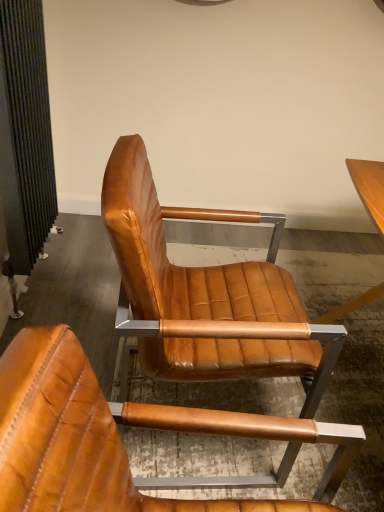
Question: Should I look upward or downward to see cognac leather chair at center, the second chair viewed from the front?

Choices:
 (A) down
 (B) up

Answer: (A)

Question: Is cognac leather chair at center, which is the 1th chair in back-to-front order, at the right side of cognac leather chair at center, marked as the first chair in a front-to-back arrangement?

Choices:
 (A) yes
 (B) no

Answer: (A)

Question: Is cognac leather chair at center, the second chair viewed from the front, in contact with cognac leather chair at center, marked as the first chair in a front-to-back arrangement?

Choices:
 (A) no
 (B) yes

Answer: (A)

Question: From a real-world perspective, is cognac leather chair at center, which is the 1th chair in back-to-front order, over cognac leather chair at center, marked as the first chair in a front-to-back arrangement?

Choices:
 (A) yes
 (B) no

Answer: (B)

Question: Is cognac leather chair at center, the second chair viewed from the front, positioned behind cognac leather chair at center, marked as the first chair in a front-to-back arrangement?

Choices:
 (A) yes
 (B) no

Answer: (A)

Question: Considering the relative sizes of cognac leather chair at center, the second chair viewed from the front, and cognac leather chair at center, marked as the first chair in a front-to-back arrangement, in the image provided, is cognac leather chair at center, the second chair viewed from the front, thinner than cognac leather chair at center, marked as the first chair in a front-to-back arrangement,?

Choices:
 (A) yes
 (B) no

Answer: (B)

Question: Is cognac leather chair at center, the second chair viewed from the front, to the left of cognac leather chair at center, marked as the first chair in a front-to-back arrangement, from the viewer's perspective?

Choices:
 (A) no
 (B) yes

Answer: (A)

Question: Is cognac leather chair at center, marked as the first chair in a front-to-back arrangement, taller than cognac leather chair at center, which is the 1th chair in back-to-front order?

Choices:
 (A) no
 (B) yes

Answer: (A)

Question: Is cognac leather chair at center, placed as the 2th chair when sorted from back to front, positioned far away from cognac leather chair at center, which is the 1th chair in back-to-front order?

Choices:
 (A) no
 (B) yes

Answer: (A)

Question: Is cognac leather chair at center, marked as the first chair in a front-to-back arrangement, to the left of cognac leather chair at center, the second chair viewed from the front, from the viewer's perspective?

Choices:
 (A) yes
 (B) no

Answer: (A)

Question: Is cognac leather chair at center, marked as the first chair in a front-to-back arrangement, looking in the opposite direction of cognac leather chair at center, which is the 1th chair in back-to-front order?

Choices:
 (A) no
 (B) yes

Answer: (A)

Question: Is cognac leather chair at center, placed as the 2th chair when sorted from back to front, closer to the viewer compared to cognac leather chair at center, which is the 1th chair in back-to-front order?

Choices:
 (A) no
 (B) yes

Answer: (B)

Question: Is cognac leather chair at center, placed as the 2th chair when sorted from back to front, at the right side of cognac leather chair at center, the second chair viewed from the front?

Choices:
 (A) yes
 (B) no

Answer: (B)

Question: Is point (170, 329) closer or farther from the camera than point (236, 429)?

Choices:
 (A) farther
 (B) closer

Answer: (A)